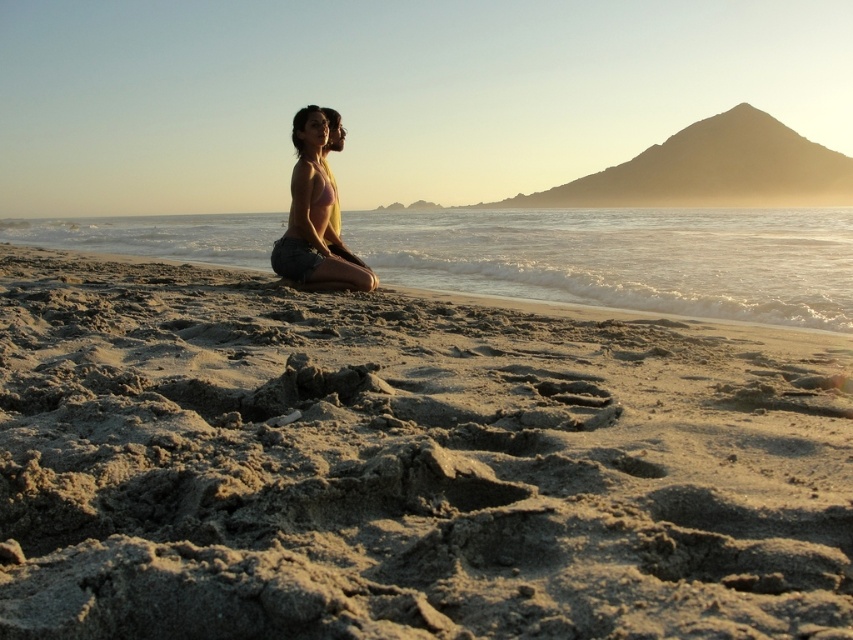
Who is shorter, fine-grained sand at center or matte yellow bikini top at center?

fine-grained sand at center

Who is positioned more to the left, fine-grained sand at center or matte yellow bikini top at center?

From the viewer's perspective, matte yellow bikini top at center appears more on the left side.

At what (x,y) coordinates should I click in order to perform the action: click on fine-grained sand at center. Please return your answer as a coordinate pair (x, y). Looking at the image, I should click on (405, 465).

Locate an element on the screen. Image resolution: width=853 pixels, height=640 pixels. fine-grained sand at center is located at coordinates (405, 465).